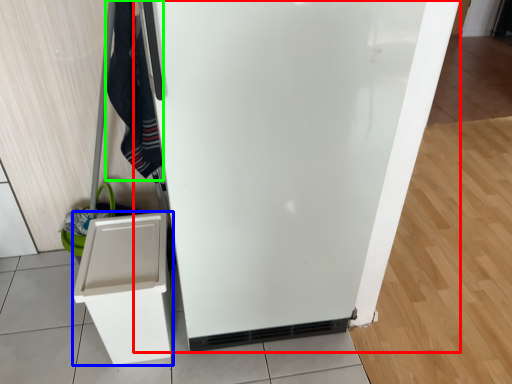
Question: Which object is the farthest from refrigerator (highlighted by a red box)? Choose among these: cabinetry (highlighted by a blue box) or clothing (highlighted by a green box).

Choices:
 (A) cabinetry
 (B) clothing

Answer: (B)